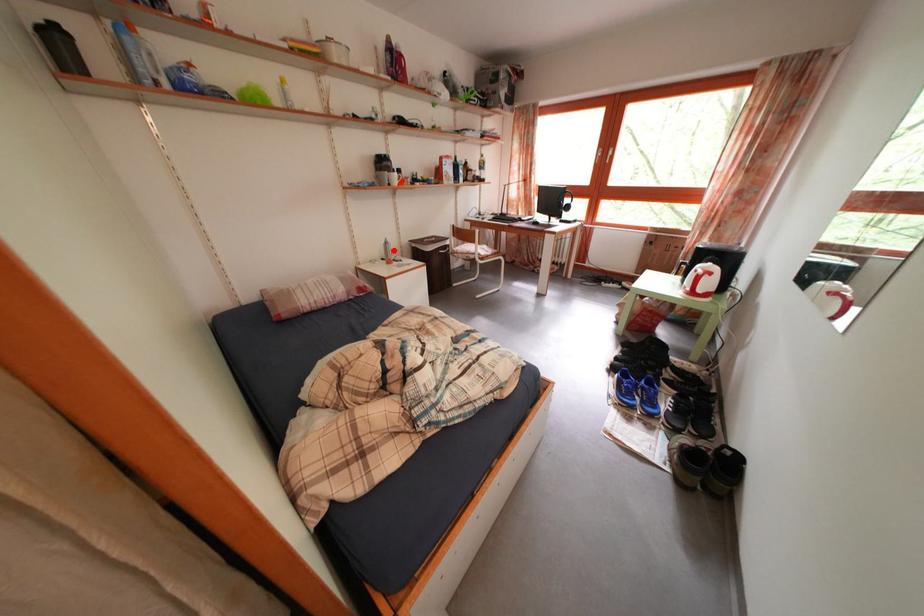
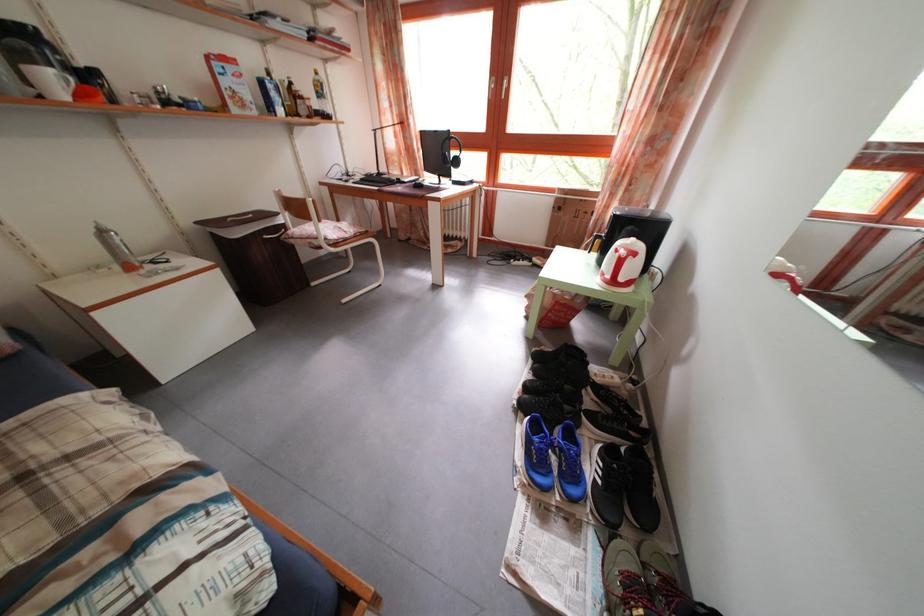
Locate, in the second image, the point that corresponds to the highlighted location in the first image.

(108, 238)